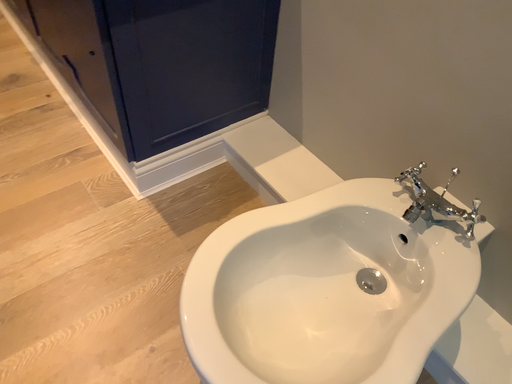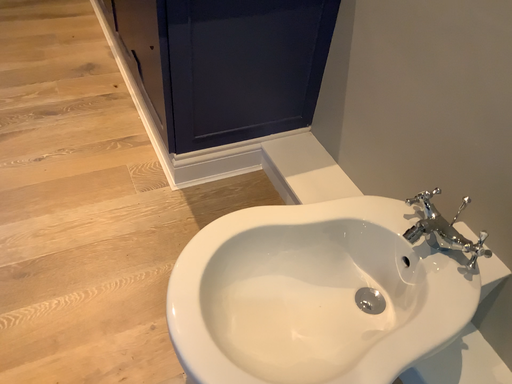
Question: How did the camera likely rotate when shooting the video?

Choices:
 (A) rotated right
 (B) rotated left

Answer: (B)